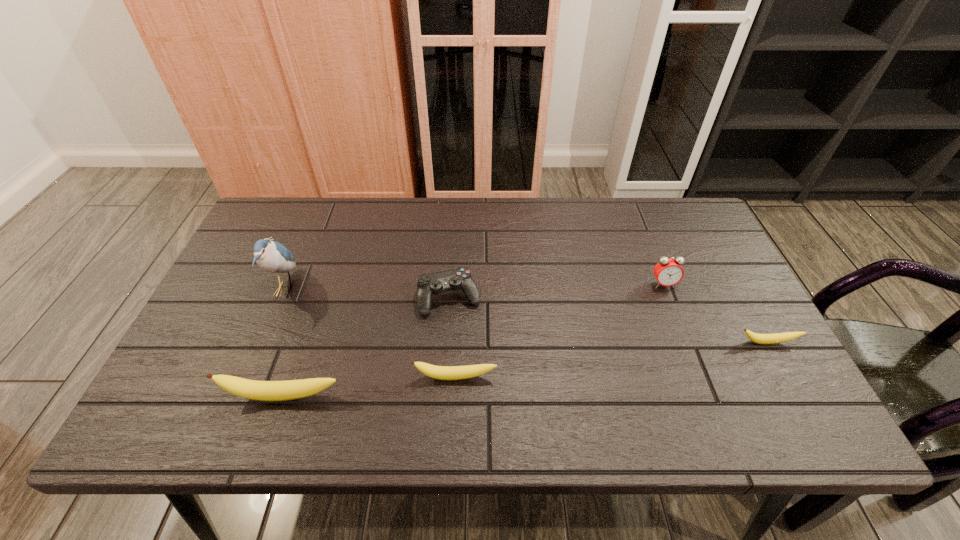
The height and width of the screenshot is (540, 960). Find the location of `vacant space located 0.050m at the tip of the tallest object's beak`. vacant space located 0.050m at the tip of the tallest object's beak is located at coordinates (316, 289).

The height and width of the screenshot is (540, 960). I want to click on vacant space located 0.100m on the front-facing side of the alarm clock, so click(x=678, y=319).

I want to click on vacant space located 0.170m on the back of the control, so click(453, 239).

I want to click on banana that is at the left edge, so click(x=251, y=389).

The height and width of the screenshot is (540, 960). I want to click on bird that is at the left edge, so click(x=271, y=256).

Image resolution: width=960 pixels, height=540 pixels. In order to click on banana that is positioned at the right edge in this screenshot , I will do `click(757, 338)`.

Locate an element on the screen. The image size is (960, 540). alarm clock present at the right edge is located at coordinates (668, 271).

Locate an element on the screen. object located in the near left corner section of the desktop is located at coordinates (251, 389).

In the image, there is a desktop. Where is `free region at the far edge`? This screenshot has width=960, height=540. free region at the far edge is located at coordinates (417, 210).

The width and height of the screenshot is (960, 540). In order to click on vacant space at the near edge of the desktop in this screenshot , I will do `click(367, 379)`.